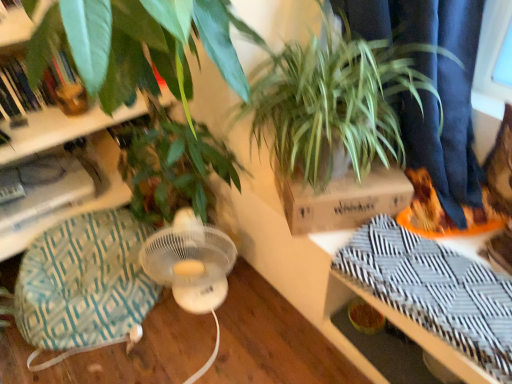
Find the location of a particular element. The width and height of the screenshot is (512, 384). vacant space to the right of white plastic fan at lower left is located at coordinates (261, 309).